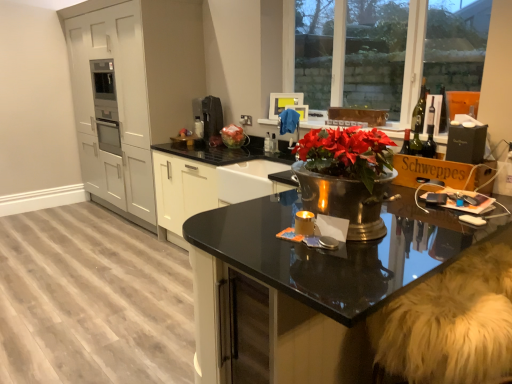
What do you see at coordinates (336, 257) in the screenshot? The height and width of the screenshot is (384, 512). I see `black glass countertop at center` at bounding box center [336, 257].

This screenshot has width=512, height=384. Describe the element at coordinates (384, 50) in the screenshot. I see `clear glass window at upper right` at that location.

Based on the photo, what is the approximate width of white fur swivel chair at lower right?

It is 20.71 inches.

Measure the distance between point (463, 347) and camera.

4.31 feet.

The height and width of the screenshot is (384, 512). Describe the element at coordinates (212, 116) in the screenshot. I see `satin black coffee machine at upper center` at that location.

Describe the element at coordinates (249, 181) in the screenshot. The height and width of the screenshot is (384, 512). I see `metallic sink at center` at that location.

You are a GUI agent. You are given a task and a screenshot of the screen. Output one action in this format:
    pyautogui.click(x=<x>, y=<y>)
    Task: Click on the matte white cabinets at left
    The width and height of the screenshot is (512, 384).
    Given the screenshot: What is the action you would take?
    pyautogui.click(x=132, y=94)

Which of these two, black glass countertop at center or metallic sink at center, is wider?

With larger width is black glass countertop at center.

Where is `countertop lying on the right of metallic sink at center`? countertop lying on the right of metallic sink at center is located at coordinates (336, 257).

Is black glass countertop at center positioned before metallic sink at center?

That is True.

In terms of height, does black glass countertop at center look taller or shorter compared to metallic sink at center?

Clearly, black glass countertop at center is taller compared to metallic sink at center.

Does metallic sink at center have a lesser height compared to satin black coffee machine at upper center?

Indeed, metallic sink at center has a lesser height compared to satin black coffee machine at upper center.

Based on the photo, from a real-world perspective, relative to satin black coffee machine at upper center, is metallic sink at center vertically above or below?

Clearly, from a real-world perspective, metallic sink at center is below satin black coffee machine at upper center.

Is metallic sink at center oriented towards satin black coffee machine at upper center?

No, metallic sink at center is not facing towards satin black coffee machine at upper center.

Which object is closer to the camera, metallic sink at center or satin black coffee machine at upper center?

metallic sink at center is in front.

From the image's perspective, is white fur swivel chair at lower right over clear glass window at upper right?

No, from the image's perspective, white fur swivel chair at lower right is not over clear glass window at upper right.

Is white fur swivel chair at lower right positioned far away from clear glass window at upper right?

white fur swivel chair at lower right is positioned a significant distance from clear glass window at upper right.

Locate an element on the screen. Image resolution: width=512 pixels, height=384 pixels. swivel chair in front of the clear glass window at upper right is located at coordinates (451, 323).

Choose the correct answer: Is white fur swivel chair at lower right inside clear glass window at upper right or outside it?

white fur swivel chair at lower right is not enclosed by clear glass window at upper right.

Are white fur swivel chair at lower right and metallic sink at center far apart?

Yes, white fur swivel chair at lower right is far from metallic sink at center.

Can you confirm if white fur swivel chair at lower right is positioned to the right of metallic sink at center?

Yes.

The height and width of the screenshot is (384, 512). What are the coordinates of `sink on the left of white fur swivel chair at lower right` in the screenshot? It's located at (249, 181).

Is matte white cabinets at left inside the boundaries of green glass wine bottle at upper right, or outside?

matte white cabinets at left is outside green glass wine bottle at upper right.

What's the angular difference between matte white cabinets at left and green glass wine bottle at upper right's facing directions?

They differ by 0.00732 degrees in their facing directions.

Is matte white cabinets at left taller or shorter than green glass wine bottle at upper right?

matte white cabinets at left is taller than green glass wine bottle at upper right.

Image resolution: width=512 pixels, height=384 pixels. Identify the location of cabinetry that appears above the white fur swivel chair at lower right (from a real-world perspective). (132, 94).

Considering the sizes of white fur swivel chair at lower right and matte white cabinets at left in the image, is white fur swivel chair at lower right taller or shorter than matte white cabinets at left?

white fur swivel chair at lower right is shorter than matte white cabinets at left.

Can you confirm if white fur swivel chair at lower right is positioned to the left of matte white cabinets at left?

In fact, white fur swivel chair at lower right is to the right of matte white cabinets at left.

Which is in front, white fur swivel chair at lower right or matte white cabinets at left?

white fur swivel chair at lower right.

From the image's perspective, is metallic sink at center located above or below black glass countertop at center?

Clearly, from the image's perspective, metallic sink at center is above black glass countertop at center.

The image size is (512, 384). Find the location of `countertop beneath the metallic sink at center (from a real-world perspective)`. countertop beneath the metallic sink at center (from a real-world perspective) is located at coordinates (336, 257).

What's the angular difference between metallic sink at center and black glass countertop at center's facing directions?

90 degrees.

Is metallic sink at center next to black glass countertop at center?

They are not placed beside each other.

The image size is (512, 384). Find the location of `countertop below the metallic sink at center (from the image's perspective)`. countertop below the metallic sink at center (from the image's perspective) is located at coordinates (336, 257).

The height and width of the screenshot is (384, 512). Identify the location of appliance that appears behind the metallic sink at center. (212, 116).

Estimate the real-world distances between objects in this image. Which object is closer to clear glass window at upper right, satin black coffee machine at upper center or black glass countertop at center?

The object closer to clear glass window at upper right is satin black coffee machine at upper center.

Looking at the image, which one is located further to satin black coffee machine at upper center, white fur swivel chair at lower right or clear glass window at upper right?

Based on the image, white fur swivel chair at lower right appears to be further to satin black coffee machine at upper center.

Based on the photo, considering their positions, is white fur swivel chair at lower right positioned closer to satin black coffee machine at upper center than black glass countertop at center?

Based on the image, black glass countertop at center appears to be nearer to satin black coffee machine at upper center.

Based on their spatial positions, is white fur swivel chair at lower right or black glass countertop at center further from metallic sink at center?

white fur swivel chair at lower right is further to metallic sink at center.

Estimate the real-world distances between objects in this image. Which object is closer to metallic sink at center, green glass wine bottle at upper right or white fur swivel chair at lower right?

green glass wine bottle at upper right.

Looking at the image, which one is located closer to black glass countertop at center, clear glass window at upper right or white fur swivel chair at lower right?

Based on the image, white fur swivel chair at lower right appears to be nearer to black glass countertop at center.

From the image, which object appears to be farther from matte white cabinets at left, wooden cardboard box at right or white fur swivel chair at lower right?

white fur swivel chair at lower right is further to matte white cabinets at left.

Considering their positions, is metallic sink at center positioned further to satin black coffee machine at upper center than wooden cardboard box at right?

wooden cardboard box at right is further to satin black coffee machine at upper center.

Identify the location of sink situated between matte white cabinets at left and wooden cardboard box at right from left to right. (249, 181).

Where is `sink between matte white cabinets at left and clear glass window at upper right`? The image size is (512, 384). sink between matte white cabinets at left and clear glass window at upper right is located at coordinates (249, 181).

Image resolution: width=512 pixels, height=384 pixels. I want to click on sink located between black glass countertop at center and satin black coffee machine at upper center in the depth direction, so click(249, 181).

Find the location of `cardboard box located between white fur swivel chair at lower right and green glass wine bottle at upper right in the depth direction`. cardboard box located between white fur swivel chair at lower right and green glass wine bottle at upper right in the depth direction is located at coordinates (440, 172).